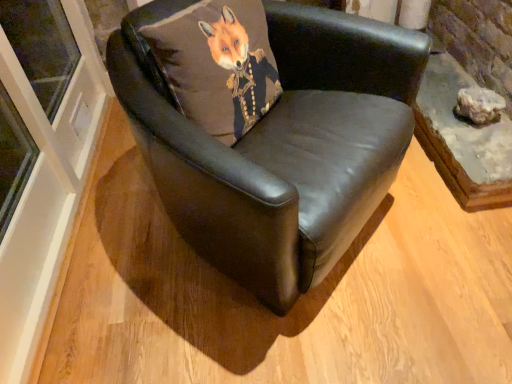
Question: From a real-world perspective, does matte gray rock at right stand above matte brown cushion at center?

Choices:
 (A) yes
 (B) no

Answer: (B)

Question: Does matte gray rock at right touch matte brown cushion at center?

Choices:
 (A) yes
 (B) no

Answer: (B)

Question: Is matte gray rock at right facing towards matte brown cushion at center?

Choices:
 (A) no
 (B) yes

Answer: (A)

Question: Does matte gray rock at right lie in front of matte brown cushion at center?

Choices:
 (A) yes
 (B) no

Answer: (B)

Question: Is matte gray rock at right not close to matte brown cushion at center?

Choices:
 (A) yes
 (B) no

Answer: (B)

Question: Would you say matte brown cushion at center is to the left or to the right of black leather chair at center in the picture?

Choices:
 (A) left
 (B) right

Answer: (A)

Question: Looking at the image, does matte brown cushion at center seem bigger or smaller compared to black leather chair at center?

Choices:
 (A) small
 (B) big

Answer: (A)

Question: From a real-world perspective, is matte brown cushion at center above or below black leather chair at center?

Choices:
 (A) below
 (B) above

Answer: (B)

Question: Considering the positions of point (226, 99) and point (283, 148), is point (226, 99) closer or farther from the camera than point (283, 148)?

Choices:
 (A) farther
 (B) closer

Answer: (A)

Question: Do you think matte gray rock at right is within black leather chair at center, or outside of it?

Choices:
 (A) inside
 (B) outside

Answer: (B)

Question: From the image's perspective, is matte gray rock at right positioned above or below black leather chair at center?

Choices:
 (A) above
 (B) below

Answer: (A)

Question: Looking at the image, does matte gray rock at right seem bigger or smaller compared to black leather chair at center?

Choices:
 (A) big
 (B) small

Answer: (B)

Question: In terms of height, does matte gray rock at right look taller or shorter compared to black leather chair at center?

Choices:
 (A) short
 (B) tall

Answer: (A)

Question: From a real-world perspective, is matte gray rock at right physically located above or below matte brown cushion at center?

Choices:
 (A) below
 (B) above

Answer: (A)

Question: Is matte gray rock at right wider or thinner than matte brown cushion at center?

Choices:
 (A) thin
 (B) wide

Answer: (A)